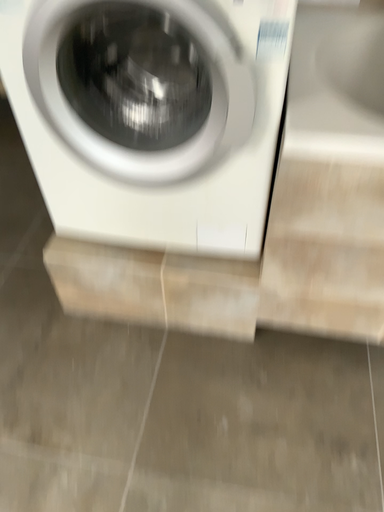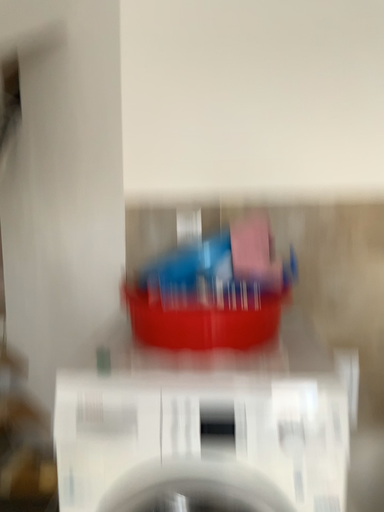
Question: Which way did the camera rotate in the video?

Choices:
 (A) rotated downward
 (B) rotated upward

Answer: (B)